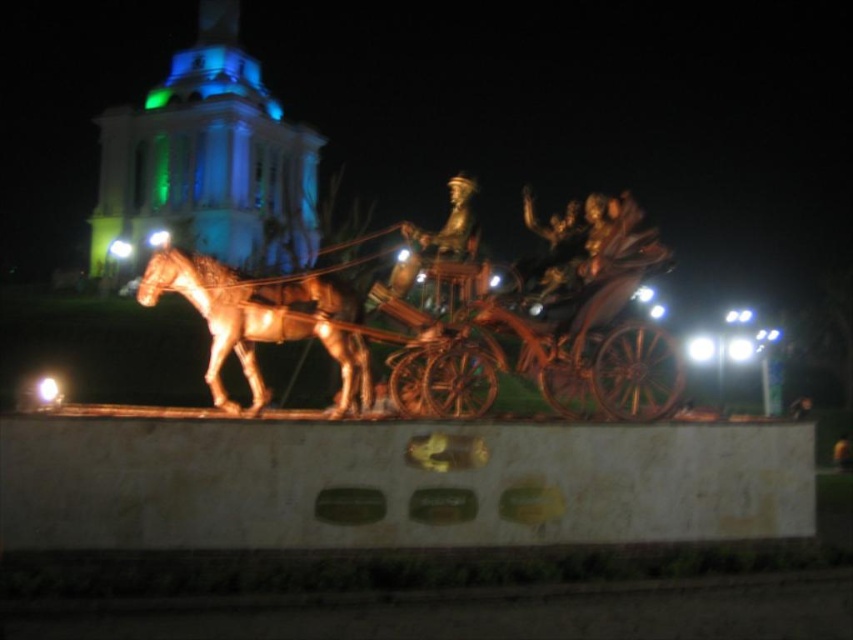
Is point (601, 346) positioned after point (239, 358)?

No, (601, 346) is closer to viewer.

Can you confirm if gold-bronze horse cart at center is positioned to the left of shiny gold horse at left?

No, gold-bronze horse cart at center is not to the left of shiny gold horse at left.

Is point (491, 298) in front of point (268, 292)?

No, it is behind (268, 292).

Locate an element on the screen. gold-bronze horse cart at center is located at coordinates (461, 326).